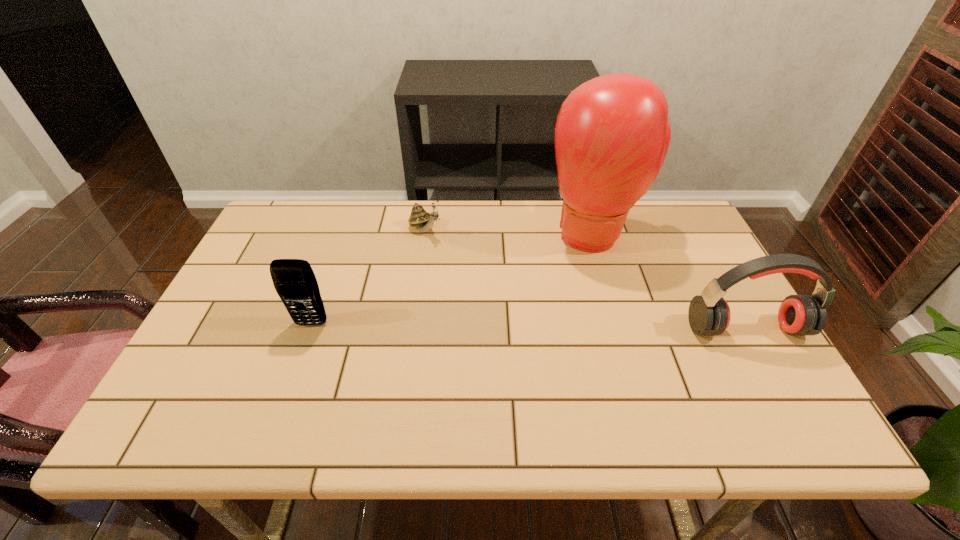
Where is `vacant space that's between the leftmost object and the second object from left to right`? This screenshot has height=540, width=960. vacant space that's between the leftmost object and the second object from left to right is located at coordinates (369, 277).

Find the location of a particular element. free point between the snail and the boxing glove is located at coordinates (510, 232).

Find the location of `empty space between the boxing glove and the cellular telephone`. empty space between the boxing glove and the cellular telephone is located at coordinates (452, 279).

Find the location of a particular element. The height and width of the screenshot is (540, 960). vacant point located between the boxing glove and the third object from right to left is located at coordinates (510, 232).

Where is `free point between the snail and the tallest object`? free point between the snail and the tallest object is located at coordinates (510, 232).

Image resolution: width=960 pixels, height=540 pixels. Identify the location of object that stands as the closest to the earphone. (612, 134).

You are a GUI agent. You are given a task and a screenshot of the screen. Output one action in this format:
    pyautogui.click(x=<x>, y=<y>)
    Task: Click on the object that is the second closest one to the snail
    
    Given the screenshot: What is the action you would take?
    pyautogui.click(x=294, y=280)

Find the location of a particular element. vacant area that satisfies the following two spatial constraints: 1. on the front side of the boxing glove; 2. on the right side of the snail is located at coordinates 425,234.